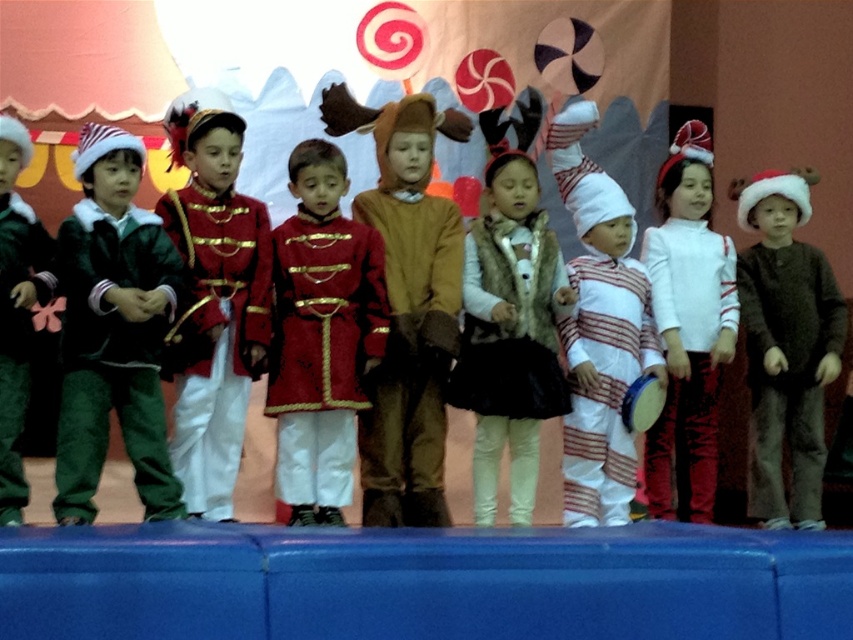
You are a photographer positioned at the front of the stage. You want to take a photo that includes both the brown fuzzy sweater at center and the matte green pants at left. However, you notice that one of the children might be blocking the other. Based on their positions, which child should move forward so that both are fully visible in the photo?

The matte green pants at left is behind the brown fuzzy sweater at center. To ensure both are visible, the child in the matte green pants at left should move forward so they are no longer blocked by the brown fuzzy sweater at center.